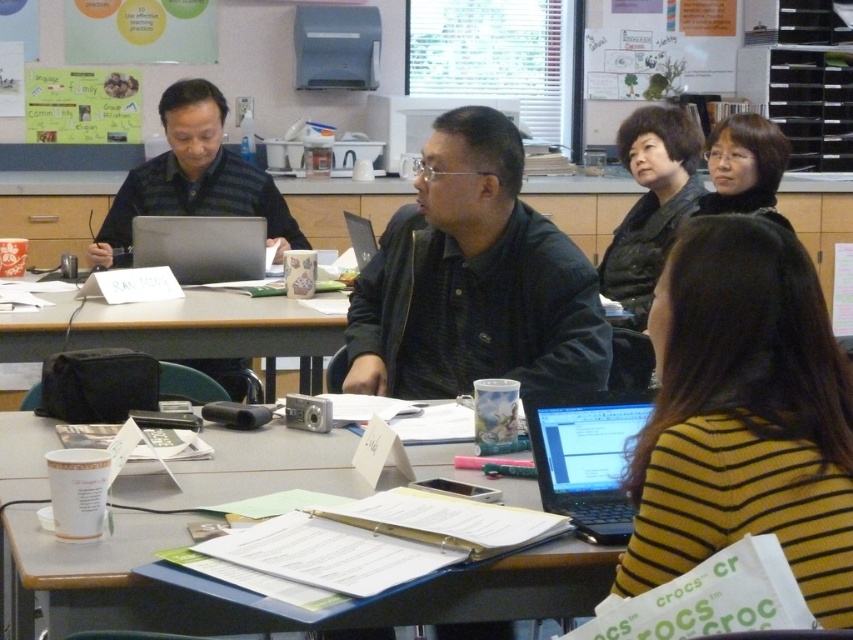
From the picture: Is matte black shirt at center above satin silver laptop at center?

Yes, matte black shirt at center is above satin silver laptop at center.

Can you confirm if matte black shirt at center is thinner than satin silver laptop at center?

Incorrect, matte black shirt at center's width is not less than satin silver laptop at center's.

The width and height of the screenshot is (853, 640). What do you see at coordinates (193, 179) in the screenshot?
I see `matte black shirt at center` at bounding box center [193, 179].

At what (x,y) coordinates should I click in order to perform the action: click on matte black shirt at center. Please return your answer as a coordinate pair (x, y). Image resolution: width=853 pixels, height=640 pixels. Looking at the image, I should click on (193, 179).

Does black matte shirt at center appear under wooden table at center?

Incorrect, black matte shirt at center is not positioned below wooden table at center.

The width and height of the screenshot is (853, 640). I want to click on black matte shirt at center, so click(x=473, y=280).

Is point (439, 349) less distant than point (291, 308)?

Yes, point (439, 349) is in front of point (291, 308).

At what (x,y) coordinates should I click in order to perform the action: click on black matte shirt at center. Please return your answer as a coordinate pair (x, y). Looking at the image, I should click on (473, 280).

Is matte plastic folder at center above satin silver laptop at center?

No, matte plastic folder at center is not above satin silver laptop at center.

Does matte plastic folder at center appear under satin silver laptop at center?

Yes, matte plastic folder at center is below satin silver laptop at center.

You are a GUI agent. You are given a task and a screenshot of the screen. Output one action in this format:
    pyautogui.click(x=<x>, y=<y>)
    Task: Click on the matte plastic folder at center
    Image resolution: width=853 pixels, height=640 pixels.
    Given the screenshot: What is the action you would take?
    pyautogui.click(x=112, y=579)